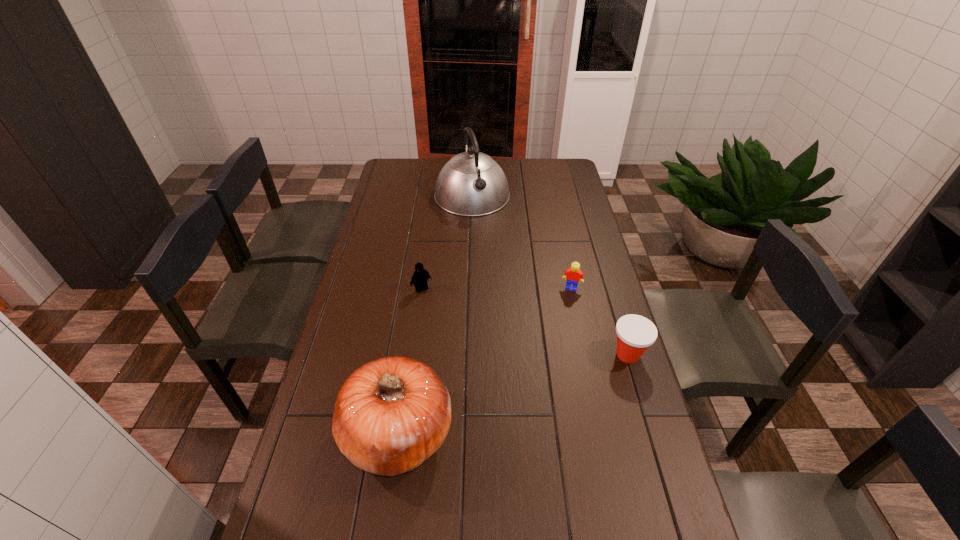
Where is `free point that satisfies the following two spatial constraints: 1. on the back side of the tallest object; 2. on the right side of the pumpkin`? Image resolution: width=960 pixels, height=540 pixels. free point that satisfies the following two spatial constraints: 1. on the back side of the tallest object; 2. on the right side of the pumpkin is located at coordinates (433, 196).